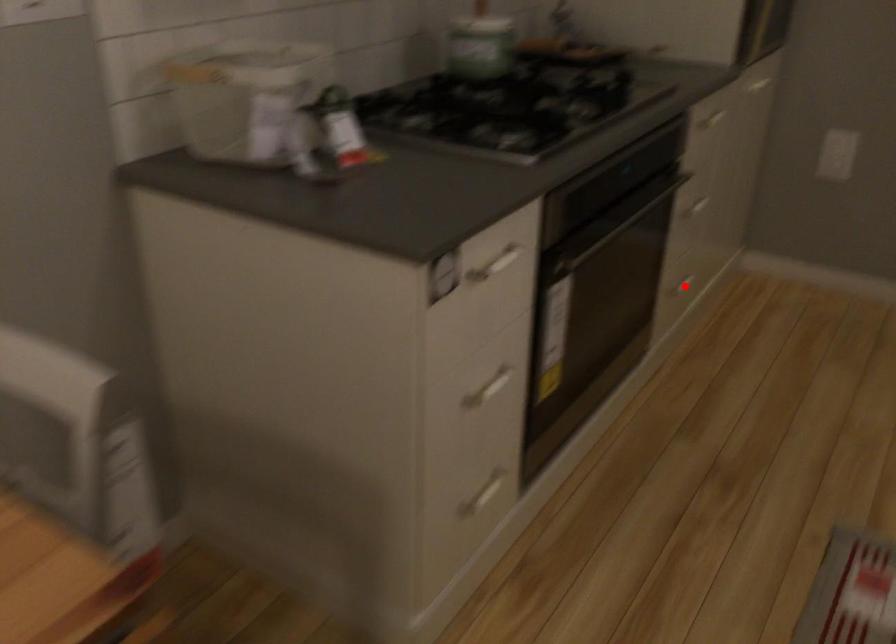
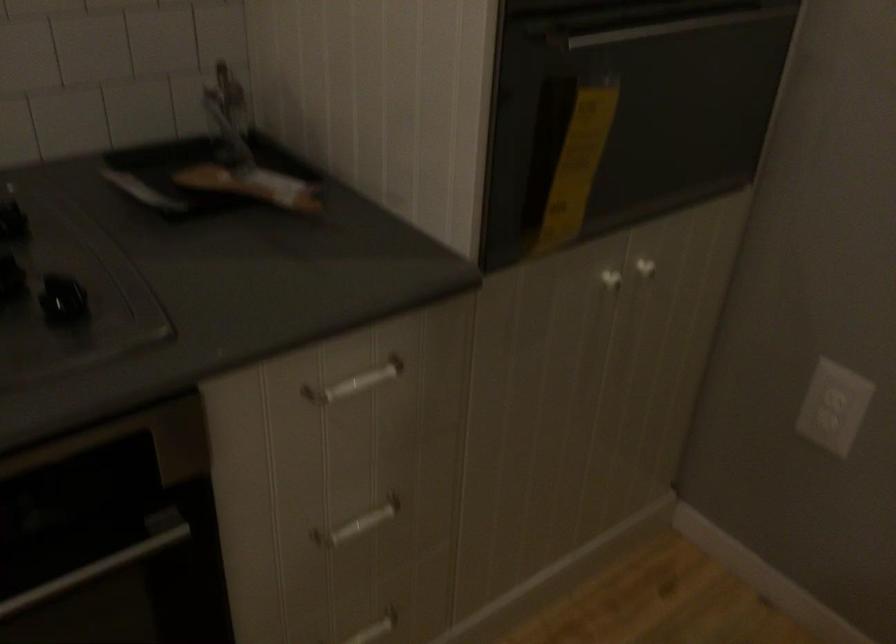
Question: I am providing you with two images of the same scene from different viewpoints. A red point is shown in image1. For the corresponding object point in image2, is it positioned nearer or farther from the camera?

Choices:
 (A) Nearer
 (B) Farther

Answer: (A)